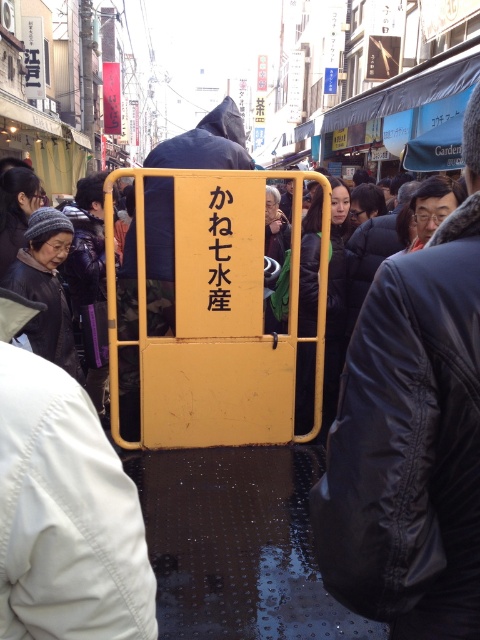
Who is lower down, yellow matte gate at center or dark gray knit hat at left?

dark gray knit hat at left is lower down.

Between yellow matte gate at center and dark gray knit hat at left, which one appears on the right side from the viewer's perspective?

From the viewer's perspective, yellow matte gate at center appears more on the right side.

What are the coordinates of `yellow matte gate at center` in the screenshot? It's located at (410, 436).